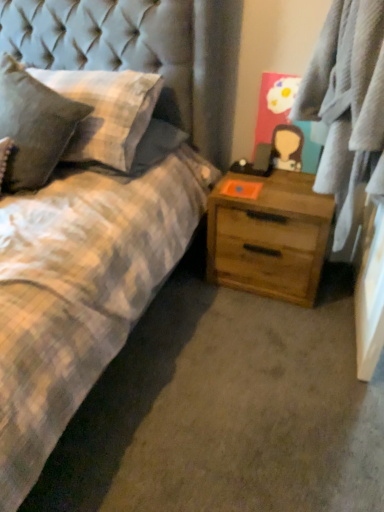
The image size is (384, 512). I want to click on blank space situated above light brown wood chest of drawers at center-right (from a real-world perspective), so point(269,185).